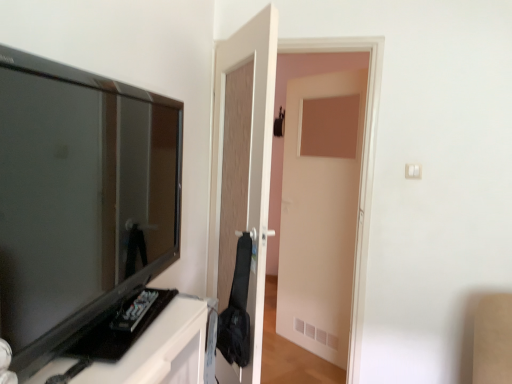
Question: Considering the relative sizes of wooden door at center and matte black tv at left in the image provided, is wooden door at center bigger than matte black tv at left?

Choices:
 (A) yes
 (B) no

Answer: (A)

Question: Is wooden door at center further to the viewer compared to matte black tv at left?

Choices:
 (A) no
 (B) yes

Answer: (B)

Question: Is wooden door at center not near matte black tv at left?

Choices:
 (A) no
 (B) yes

Answer: (A)

Question: Does wooden door at center contain matte black tv at left?

Choices:
 (A) no
 (B) yes

Answer: (A)

Question: Is wooden door at center thinner than matte black tv at left?

Choices:
 (A) no
 (B) yes

Answer: (A)

Question: Does wooden door at center have a greater height compared to matte black tv at left?

Choices:
 (A) yes
 (B) no

Answer: (A)

Question: Would you consider matte black tv at left to be distant from wooden door at center?

Choices:
 (A) yes
 (B) no

Answer: (B)

Question: Is matte black tv at left behind wooden door at center?

Choices:
 (A) yes
 (B) no

Answer: (B)

Question: Is matte black tv at left oriented away from wooden door at center?

Choices:
 (A) yes
 (B) no

Answer: (B)

Question: Considering the relative sizes of matte black tv at left and wooden door at center in the image provided, is matte black tv at left bigger than wooden door at center?

Choices:
 (A) yes
 (B) no

Answer: (B)

Question: From the image's perspective, is matte black tv at left on top of wooden door at center?

Choices:
 (A) no
 (B) yes

Answer: (B)

Question: Does matte black tv at left have a greater width compared to wooden door at center?

Choices:
 (A) no
 (B) yes

Answer: (A)

Question: Which is correct: matte black tv at left is inside wooden door at center, or outside of it?

Choices:
 (A) outside
 (B) inside

Answer: (A)